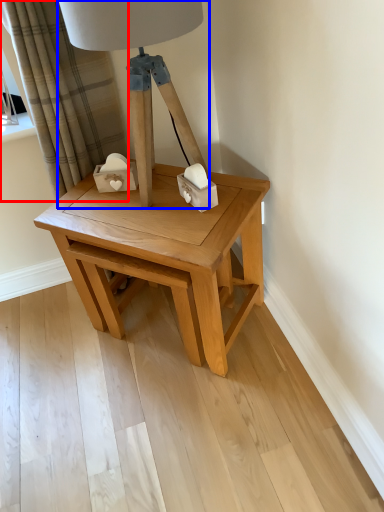
Question: Which object appears farthest to the camera in this image, curtain (highlighted by a red box) or table lamp (highlighted by a blue box)?

Choices:
 (A) curtain
 (B) table lamp

Answer: (A)